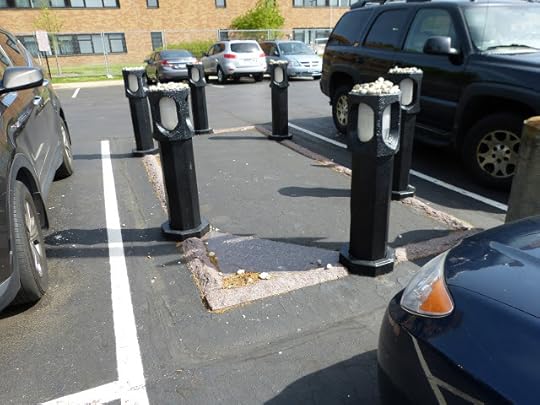
Find the location of a particular element. light is located at coordinates (171, 118).